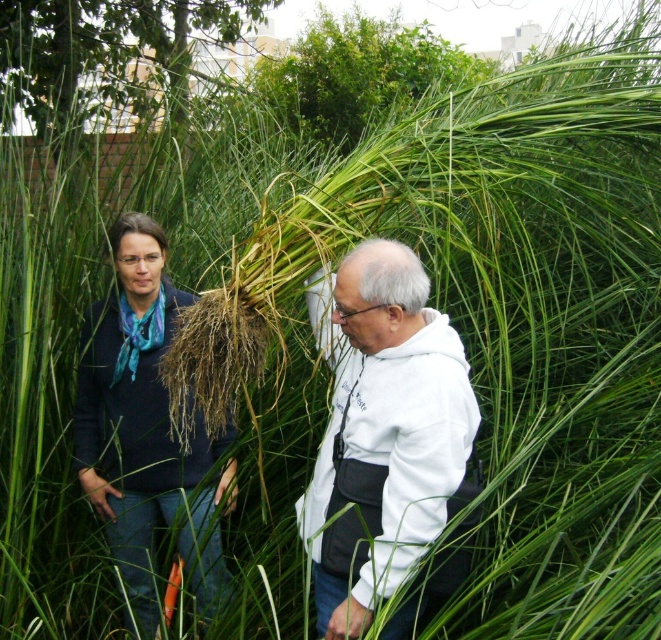
You are a photographer trying to capture a clear shot of both the white hoodie at center and the green leafy bush at upper center. Given that your camera has a maximum focus range of 5 meters, will you be able to include both subjects in focus in a single shot?

The white hoodie at center and green leafy bush at upper center are 4.97 meters apart from each other. Since the distance between them is within the camera maximum focus range of 5 meters, you can include both subjects in focus in a single shot.

From the picture: You are a photographer trying to capture a clear shot of the white fleece jacket at center and the blue fabric scarf at left. Based on their positions, which object will appear closer to the camera in the photo?

The white fleece jacket at center appears closer to the camera because it is positioned in front of the blue fabric scarf at left.